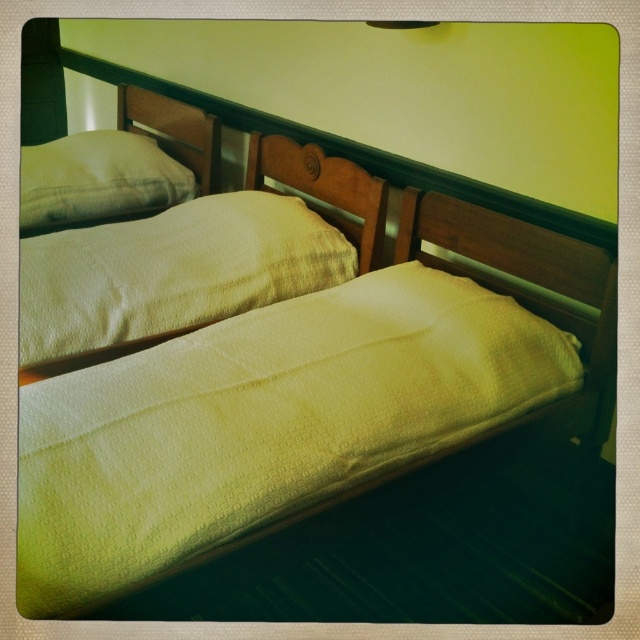
Question: Is white textured pillow at upper center bigger than white textured pillow at upper left?

Choices:
 (A) yes
 (B) no

Answer: (A)

Question: Among these points, which one is farthest from the camera?

Choices:
 (A) (269, 163)
 (B) (193, 193)
 (C) (220, 301)

Answer: (B)

Question: Considering the real-world distances, which object is farthest from the white textured pillow at upper center?

Choices:
 (A) wooden headboard at center
 (B) white textured pillow at upper left

Answer: (B)

Question: Does white textured pillow at upper center have a smaller size compared to white textured pillow at upper left?

Choices:
 (A) no
 (B) yes

Answer: (A)

Question: Which of the following is the farthest from the observer?

Choices:
 (A) white textured pillow at upper left
 (B) white textured pillow at upper center
 (C) wooden headboard at center

Answer: (A)

Question: Does white textured pillow at upper center appear over wooden headboard at center?

Choices:
 (A) no
 (B) yes

Answer: (A)